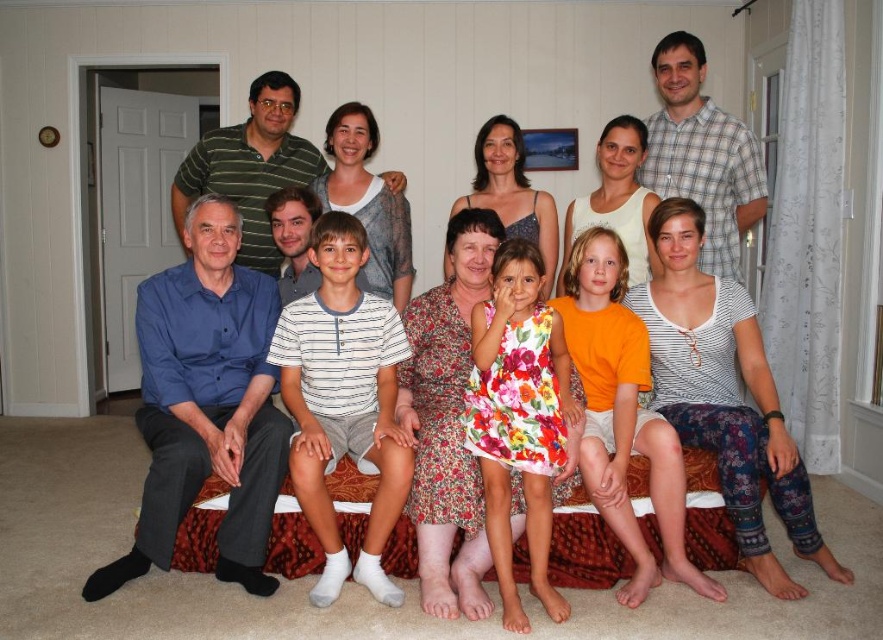
You are standing in the living room and want to place a small potted plant exactly at the point marked as point (340, 426). If you are currently 10 feet away from that spot, can you move closer by 0.26 feet to place it accurately?

The distance of point (340, 426) from the viewer is 9.74 feet. Since you are currently 10 feet away, moving closer by 0.26 feet would bring you to 9.74 feet, which matches the required distance. Yes, you can move closer by 0.26 feet to place the plant accurately.

You are standing in front of the family photo and want to touch the two points labeled in the image. Which point, point (340, 289) or point (479, 314), is closer to your hand?

Point (340, 289) is closer to your hand because it is further to the camera than point (479, 314), meaning it is physically nearer to the observer.

In the family photo, there are two people wearing a white striped shirt at center and a floral cotton dress at center. Which one is positioned to the left?

The white striped shirt at center is to the left of the floral cotton dress at center.